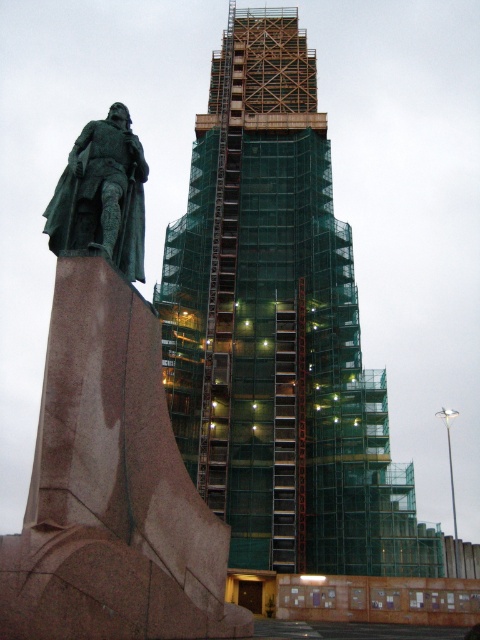
You are an architect inspecting the construction site. You notice the green polished stone statue at left and the green mesh scaffolding at center. Which object is closer to the front of the image?

The green mesh scaffolding at center is closer to the front of the image because the green polished stone statue at left is behind it.

You are an architect evaluating the construction site. You see the green mesh scaffolding at center and the green patina statue at left. Which one has a greater height?

The green mesh scaffolding at center is taller than the green patina statue at left according to the description.

You are standing in the middle of the image and want to move towards the green mesh scaffolding at center. Which direction should you move to reach it?

Since the green mesh scaffolding at center is located at point coordinates of (278, 330), you are already at the center of the image, so you don not need to move in any direction to reach it.